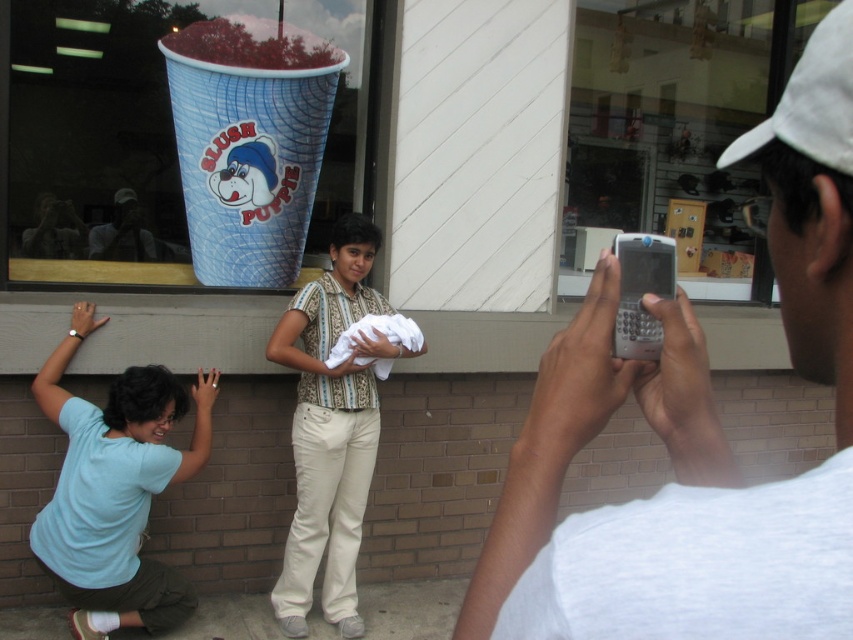
Question: Which point is farther from the camera taking this photo?

Choices:
 (A) (664, 518)
 (B) (155, 394)
 (C) (341, 532)

Answer: (C)

Question: Where is light blue t-shirt at lower left located in relation to striped cotton shirt at center in the image?

Choices:
 (A) left
 (B) right

Answer: (A)

Question: Does silver metallic phone at upper right appear over striped cotton shirt at center?

Choices:
 (A) no
 (B) yes

Answer: (B)

Question: Can you confirm if light blue t-shirt at lower left is positioned to the left of striped cotton shirt at center?

Choices:
 (A) yes
 (B) no

Answer: (A)

Question: Among these points, which one is nearest to the camera?

Choices:
 (A) (173, 577)
 (B) (585, 536)

Answer: (B)

Question: Which object appears closest to the camera in this image?

Choices:
 (A) striped cotton shirt at center
 (B) light blue t-shirt at lower left
 (C) silver metallic phone at upper right

Answer: (C)